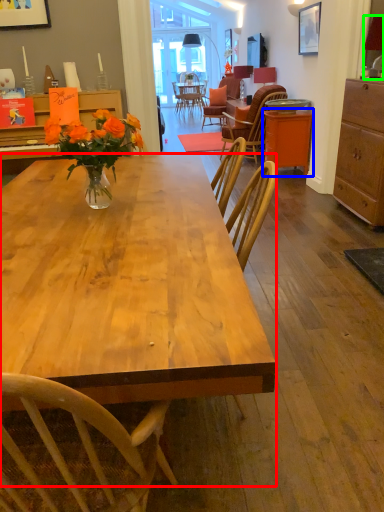
Question: Considering the real-world distances, which object is farthest from desk (highlighted by a red box)? table (highlighted by a blue box) or lamp (highlighted by a green box)?

Choices:
 (A) table
 (B) lamp

Answer: (A)